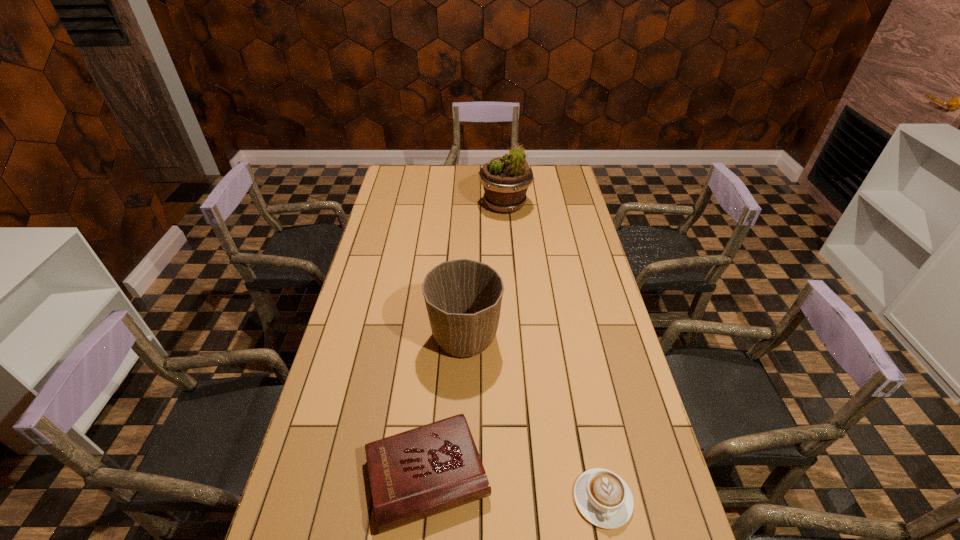
Where is `vacant region at the far edge`? vacant region at the far edge is located at coordinates (535, 188).

Locate an element on the screen. free region at the left edge of the desktop is located at coordinates (337, 468).

This screenshot has height=540, width=960. I want to click on vacant space at the right edge, so tap(586, 239).

The width and height of the screenshot is (960, 540). In order to click on free space between the cappuccino and the nearer flowerpot in this screenshot , I will do `click(534, 417)`.

Locate an element on the screen. unoccupied position between the cappuccino and the farther flowerpot is located at coordinates (554, 352).

Where is `free spot between the hardback book and the third shortest object`? Image resolution: width=960 pixels, height=540 pixels. free spot between the hardback book and the third shortest object is located at coordinates (446, 406).

The height and width of the screenshot is (540, 960). In order to click on free space between the cappuccino and the hardback book in this screenshot , I will do pos(516,487).

The image size is (960, 540). I want to click on free space between the cappuccino and the farther flowerpot, so click(554, 352).

The width and height of the screenshot is (960, 540). I want to click on empty location between the cappuccino and the shorter flowerpot, so click(534, 417).

This screenshot has width=960, height=540. Find the location of `empty location between the hardback book and the third shortest object`. empty location between the hardback book and the third shortest object is located at coordinates (446, 406).